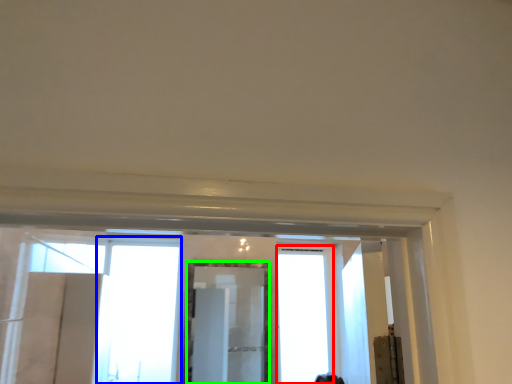
Question: Considering the real-world distances, which object is farthest from window (highlighted by a red box)? window (highlighted by a blue box) or mirror (highlighted by a green box)?

Choices:
 (A) window
 (B) mirror

Answer: (A)